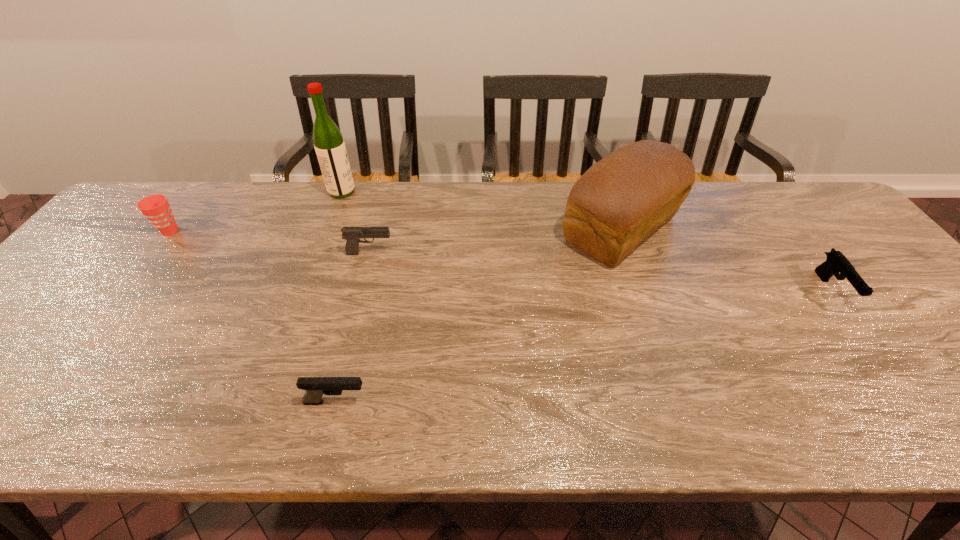
You are a GUI agent. You are given a task and a screenshot of the screen. Output one action in this format:
    pyautogui.click(x=<x>, y=<y>)
    Task: Click on the free space located on the left of the second object from right to left
    This screenshot has width=960, height=540.
    Given the screenshot: What is the action you would take?
    pyautogui.click(x=501, y=229)

You are a GUI agent. You are given a task and a screenshot of the screen. Output one action in this format:
    pyautogui.click(x=<x>, y=<y>)
    Task: Click on the free space located on the front of the cup
    This screenshot has height=540, width=960.
    Given the screenshot: What is the action you would take?
    pyautogui.click(x=79, y=352)

The width and height of the screenshot is (960, 540). I want to click on free region located aim along the barrel of the farthest pistol, so click(x=467, y=253).

The height and width of the screenshot is (540, 960). Find the location of `free space located 0.160m on the front-facing side of the rightmost pistol`. free space located 0.160m on the front-facing side of the rightmost pistol is located at coordinates (894, 373).

This screenshot has height=540, width=960. I want to click on vacant space located 0.400m on the front-facing side of the nearest object, so click(566, 402).

I want to click on liquor located at the far edge, so click(x=329, y=145).

Locate an element on the screen. Image resolution: width=960 pixels, height=540 pixels. bread that is at the far edge is located at coordinates (618, 202).

At what (x,y) coordinates should I click in order to perform the action: click on cup present at the far edge. Please return your answer as a coordinate pair (x, y). The height and width of the screenshot is (540, 960). Looking at the image, I should click on (156, 208).

Locate an element on the screen. object located in the near edge section of the desktop is located at coordinates (315, 387).

Where is `object positioned at the left edge`? The height and width of the screenshot is (540, 960). object positioned at the left edge is located at coordinates (156, 208).